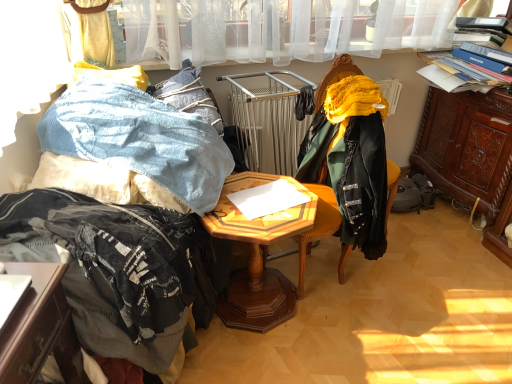
You are a GUI agent. You are given a task and a screenshot of the screen. Output one action in this format:
    pyautogui.click(x=<x>, y=<y>)
    Task: Click on the free spot above woodenobject at center (from a real-world perspective)
    
    Given the screenshot: What is the action you would take?
    click(x=262, y=205)